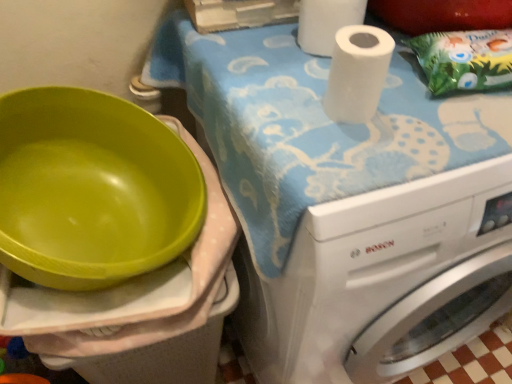
Find the location of `vacant area that is in front of white matte paper towel at upper center, the 2th paper towel in the back-to-front sequence`. vacant area that is in front of white matte paper towel at upper center, the 2th paper towel in the back-to-front sequence is located at coordinates (360, 165).